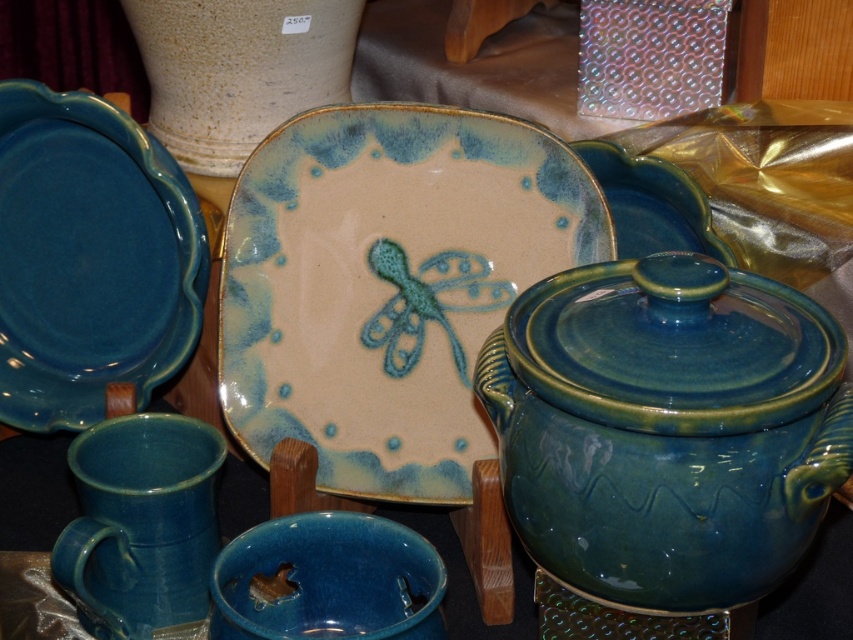
Is point (375, 385) closer to viewer compared to point (637, 560)?

That is False.

Measure the distance between point (352, 417) and camera.

A distance of 30.79 inches exists between point (352, 417) and camera.

Does point (378, 404) come behind point (810, 337)?

Yes, it is.

This screenshot has height=640, width=853. Find the location of `matte ceramic plate at center`. matte ceramic plate at center is located at coordinates (387, 284).

Is blue glossy teapot at right above matte ceramic mug at lower left?

Yes.

Is point (717, 540) positioned after point (120, 500)?

No, (717, 540) is closer to viewer.

The image size is (853, 640). Find the location of `blue glossy teapot at right`. blue glossy teapot at right is located at coordinates (666, 428).

Consider the image. Is matte ceramic plate at center closer to the viewer compared to matte blue plate at left?

Yes.

Describe the element at coordinates (387, 284) in the screenshot. The height and width of the screenshot is (640, 853). I see `matte ceramic plate at center` at that location.

Is point (235, 204) behind point (93, 113)?

Yes, point (235, 204) is behind point (93, 113).

I want to click on matte ceramic plate at center, so click(387, 284).